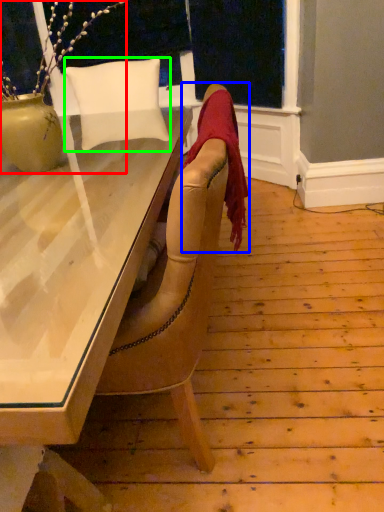
Question: Which object is the farthest from houseplant (highlighted by a red box)? Choose among these: blanket (highlighted by a blue box) or pillow (highlighted by a green box).

Choices:
 (A) blanket
 (B) pillow

Answer: (A)